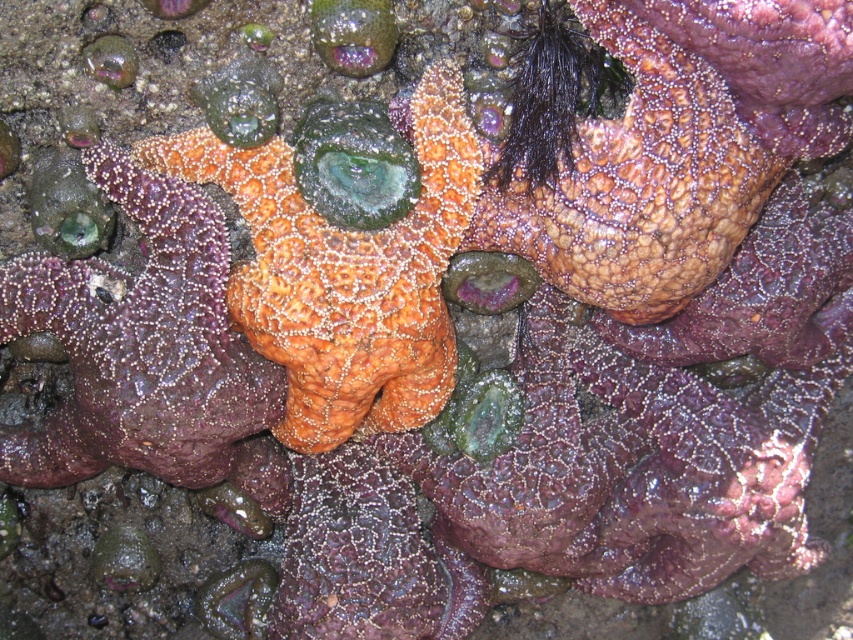
You are a marine biologist examining the marine ecosystem. You notice two starfish species in the image. The rough textured starfish at center and the orange textured starfish at center. Which one is positioned to the right of the other?

The rough textured starfish at center is positioned to the right of the orange textured starfish at center.

You are a marine biologist examining the marine ecosystem in the image. You need to determine the spatial relationship between the rough textured starfish at center and the orange matte starfish at center. Which one is positioned higher in the image?

The rough textured starfish at center is located above the orange matte starfish at center, so it is positioned higher in the image.